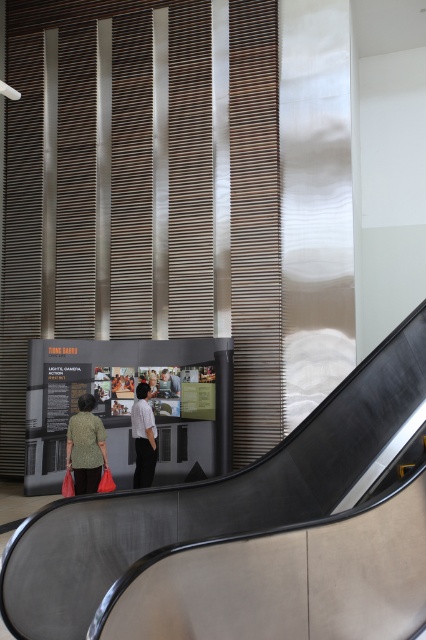
You are standing at the base of the curved escalator and want to take a photo that includes both the point at coordinates point [275,508] and point [103,445]. Which point will appear larger in your photo?

Point [275,508] is closer to the camera than point [103,445], so it will appear larger in the photo.

You are a maintenance worker needing to reach the white textured shirt at center from the metallic gray escalator at lower center. Given that your tool cart is 3 meters long, can you safely maneuver it in the space between them?

The distance between the metallic gray escalator at lower center and the white textured shirt at center is 3.20 meters. Since the tool cart is 3 meters long, there is enough space to safely maneuver it between them.